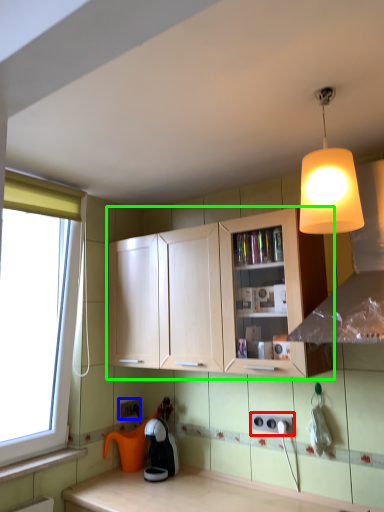
Question: Which object is positioned closest to electric outlet (highlighted by a red box)? Select from electric outlet (highlighted by a blue box) and cabinetry (highlighted by a green box).

Choices:
 (A) electric outlet
 (B) cabinetry

Answer: (B)